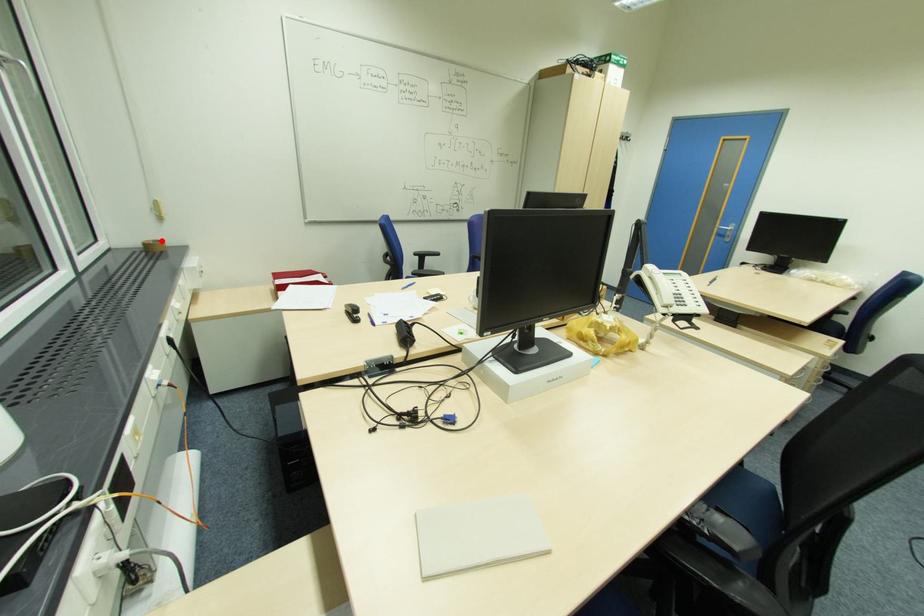
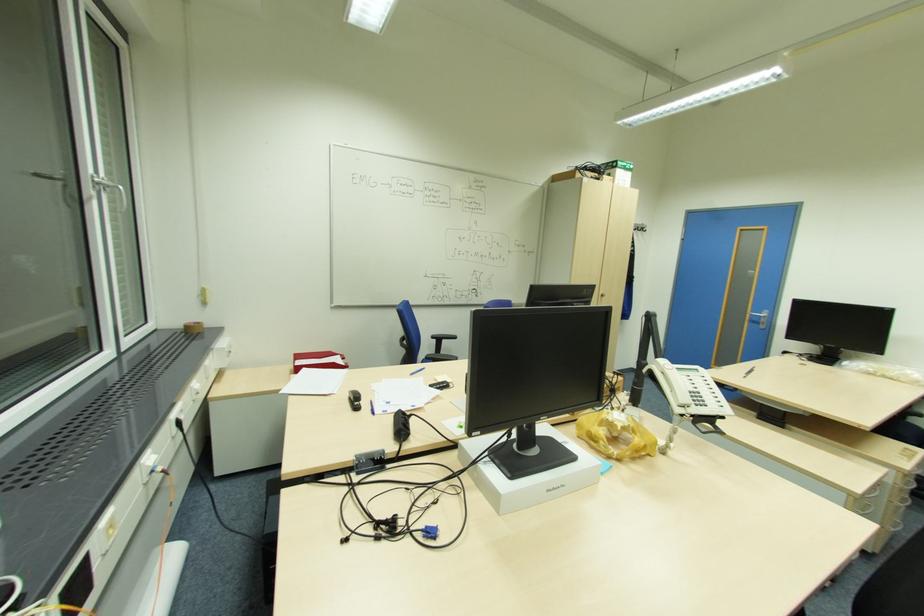
Locate, in the second image, the point that corresponds to the highlighted location in the first image.

(201, 323)